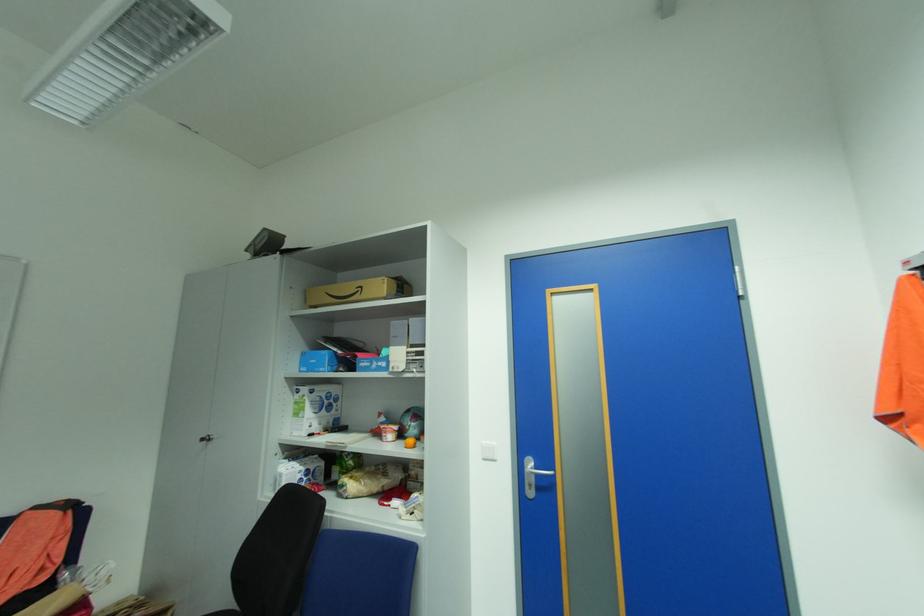
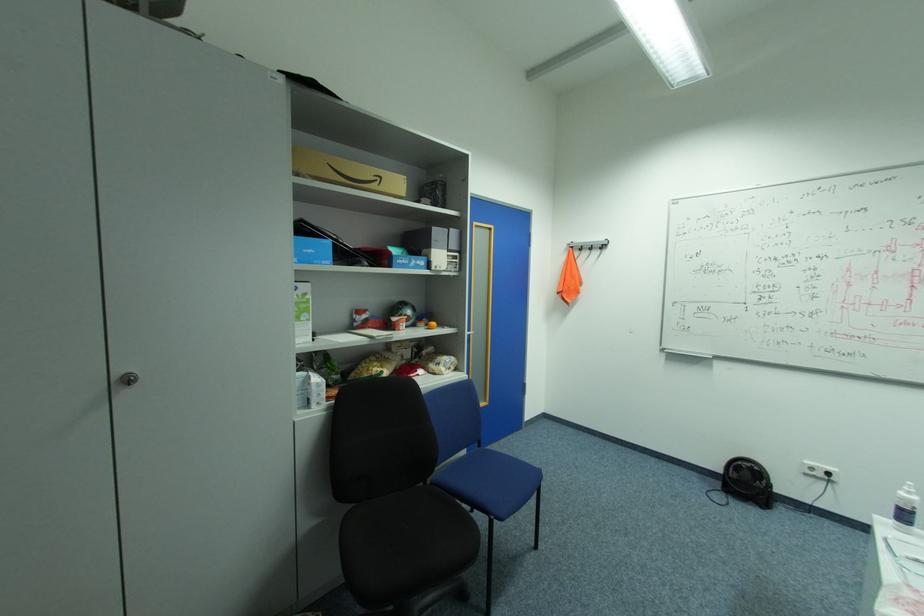
Find the pixel in the second image that matches (x=285, y=477) in the first image.

(321, 387)